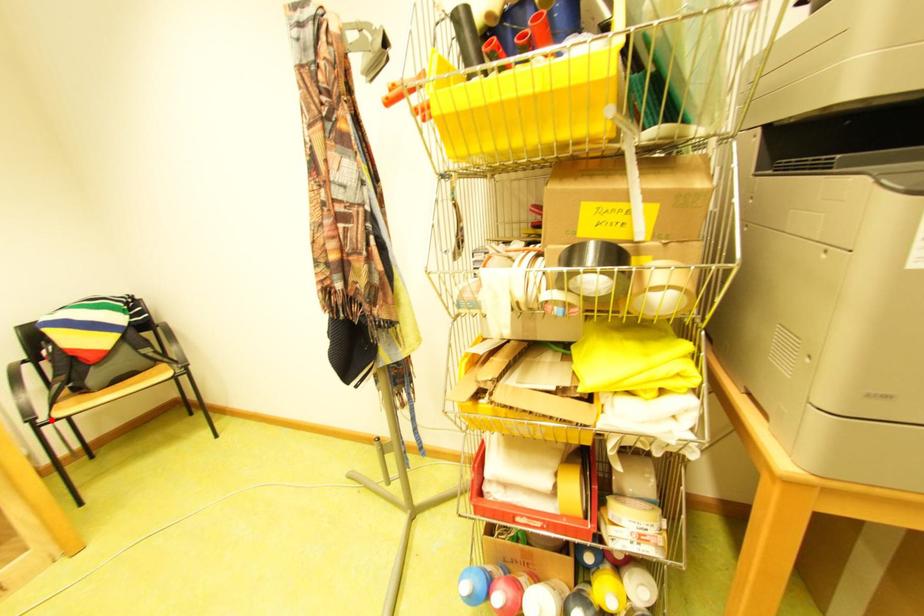
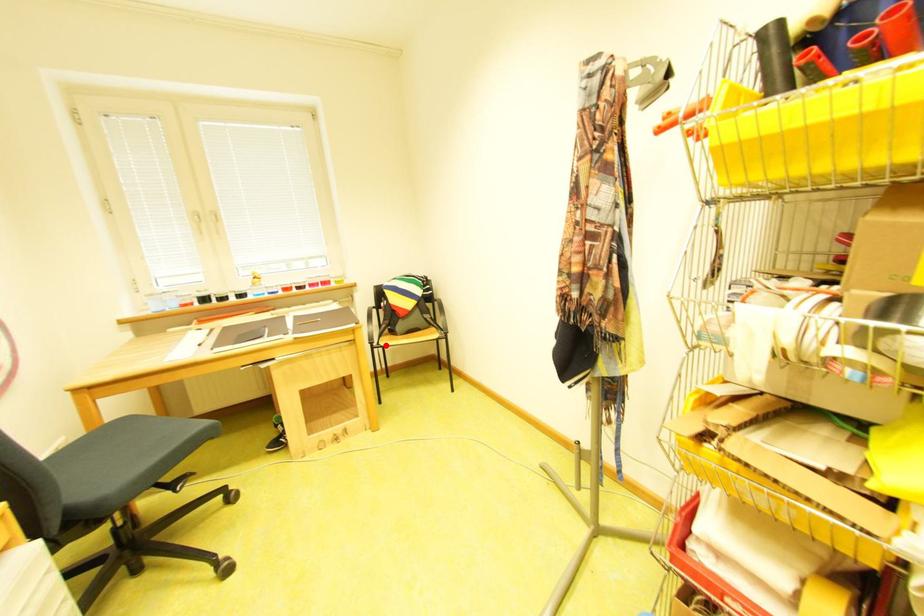
I am providing you with two images of the same scene from different viewpoints. A red point is marked on the first image and another point is marked on the second image. Do the highlighted points in image1 and image2 indicate the same real-world spot?

Yes